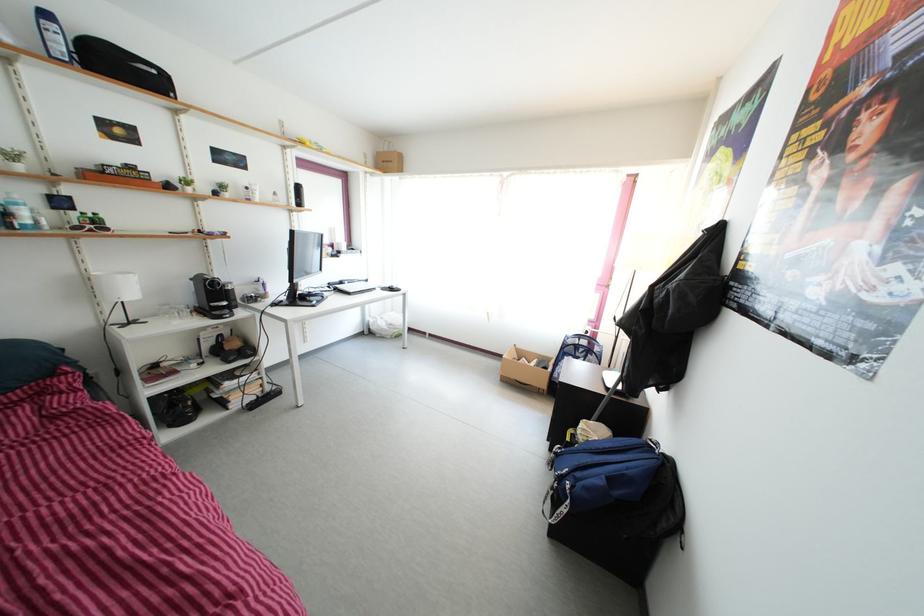
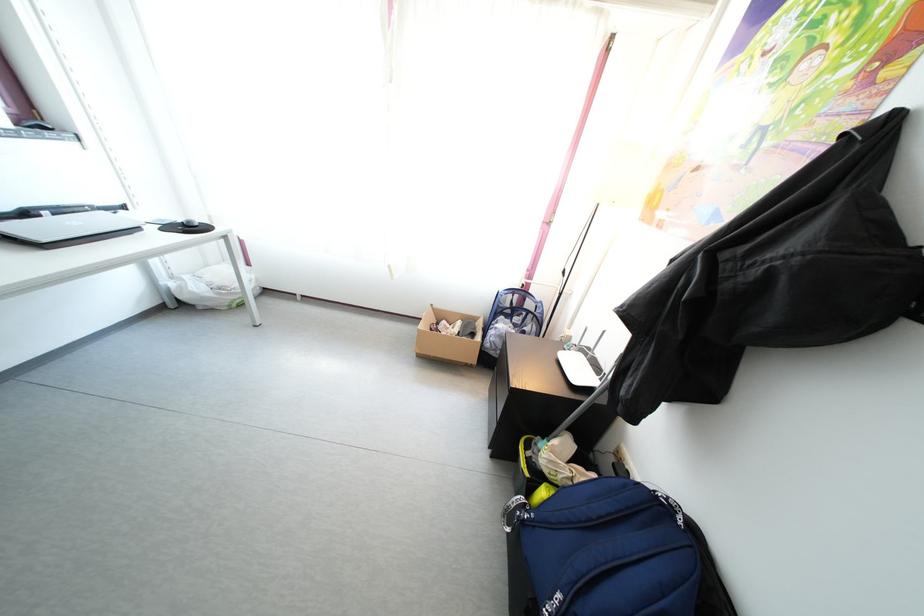
How did the camera likely rotate?

The camera's rotation is toward right-down.